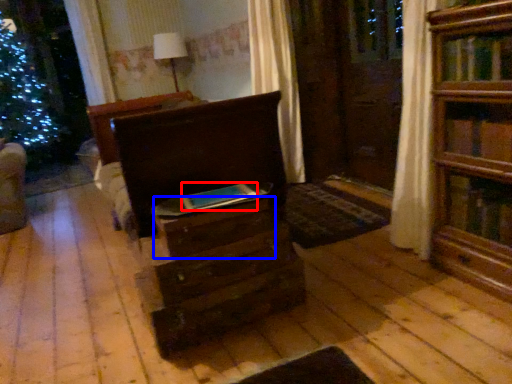
Question: Among these objects, which one is farthest to the camera, book (highlighted by a red box) or drawer (highlighted by a blue box)?

Choices:
 (A) book
 (B) drawer

Answer: (A)